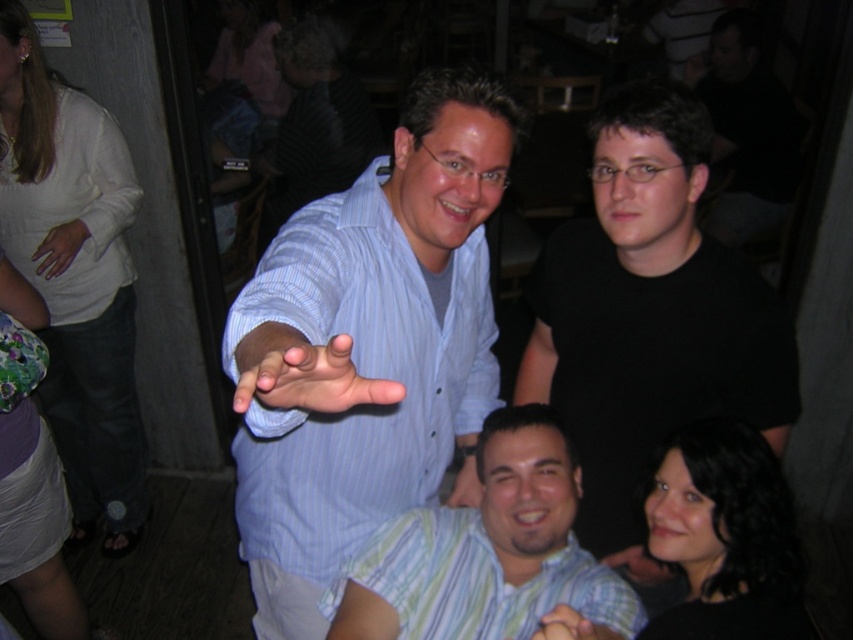
You are a photographer adjusting your camera settings to focus on two points in the image. The first point is point (125, 419) and the second is point (633, 548). Which point is closer to the camera?

Point (125, 419) is closer to the camera than point (633, 548).

You are at a social event and want to take a photo of the blue striped shirt at center. Where should you position yourself to capture it in the frame?

The blue striped shirt at center is located at point (367, 346), so position yourself directly facing the coordinates to include it in the photo.

You are a photographer trying to capture a candid shot of the scene. You want to ensure that both the white cotton shirt at upper left and the matte black hand at lower center are in focus. Given the distance between them, will you need to adjust your camera settings to accommodate the depth of field?

The distance between the white cotton shirt at upper left and the matte black hand at lower center is 5.42 feet. To ensure both are in focus, you should adjust your camera settings to increase the depth of field, such as using a smaller aperture.